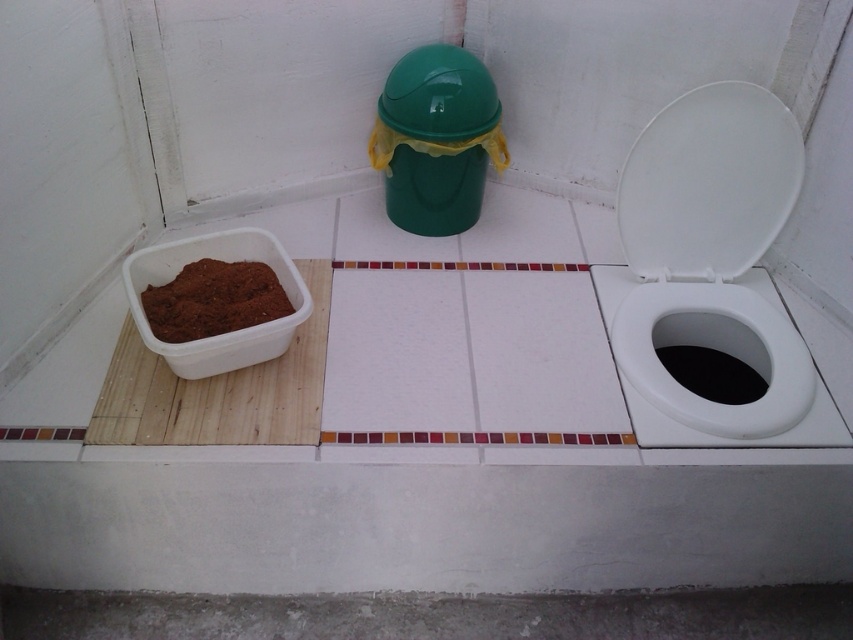
Question: Where is white glossy toilet lid at upper right located in relation to green matte trash can lid at upper center in the image?

Choices:
 (A) left
 (B) right

Answer: (B)

Question: Which of the following is the farthest from the observer?

Choices:
 (A) white glossy toilet bowl at lower right
 (B) green matte trash can lid at upper center

Answer: (B)

Question: Which object is farther from the camera taking this photo?

Choices:
 (A) green matte trash can lid at upper center
 (B) white glossy toilet bowl at lower right
 (C) white glossy toilet lid at upper right

Answer: (A)

Question: Which object appears closest to the camera in this image?

Choices:
 (A) green matte trash can lid at upper center
 (B) white glossy toilet lid at upper right

Answer: (B)

Question: Is white glossy toilet bowl at lower right positioned before green matte trash can lid at upper center?

Choices:
 (A) yes
 (B) no

Answer: (A)

Question: Can you confirm if white glossy toilet lid at upper right is bigger than white glossy toilet bowl at lower right?

Choices:
 (A) yes
 (B) no

Answer: (A)